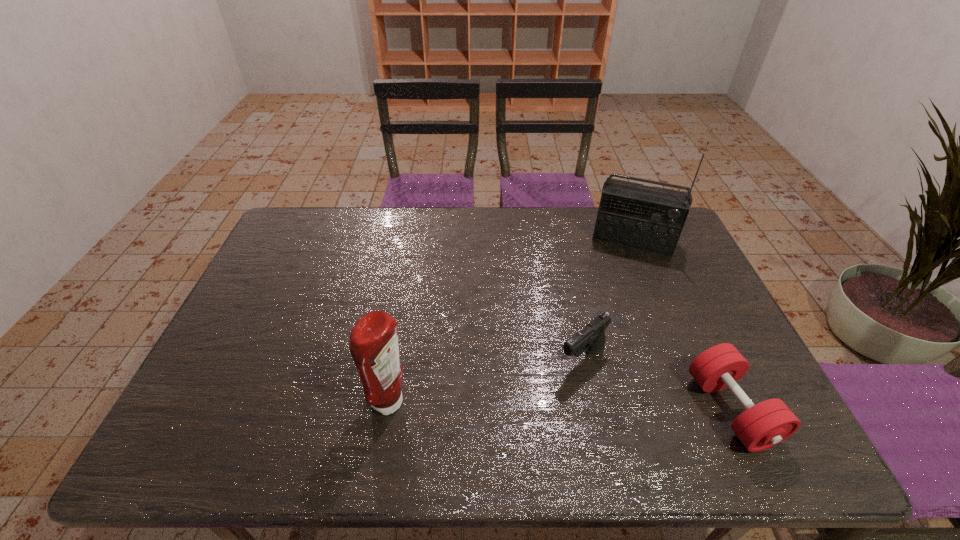
You are a GUI agent. You are given a task and a screenshot of the screen. Output one action in this format:
    pyautogui.click(x=<x>, y=<y>)
    Task: Click on the object present at the near right corner
    The image size is (960, 540).
    Given the screenshot: What is the action you would take?
    pyautogui.click(x=761, y=426)

The image size is (960, 540). I want to click on vacant area at the far edge of the desktop, so click(448, 212).

This screenshot has height=540, width=960. In the image, there is a desktop. Identify the location of vacant area at the near edge. (499, 401).

Identify the location of free point at the left edge. (273, 267).

Identify the location of vacant space at the right edge of the desktop. (673, 283).

Where is `vacant space at the far left corner of the desktop`? Image resolution: width=960 pixels, height=540 pixels. vacant space at the far left corner of the desktop is located at coordinates (305, 232).

You are a GUI agent. You are given a task and a screenshot of the screen. Output one action in this format:
    pyautogui.click(x=<x>, y=<y>)
    Task: Click on the vacant space at the far right corner
    The height and width of the screenshot is (540, 960).
    Given the screenshot: What is the action you would take?
    pyautogui.click(x=681, y=237)

You are a GUI agent. You are given a task and a screenshot of the screen. Output one action in this format:
    pyautogui.click(x=<x>, y=<y>)
    Task: Click on the free space between the pistol and the dumbbell
    
    Given the screenshot: What is the action you would take?
    pyautogui.click(x=657, y=384)

Locate an element on the screen. free space between the dumbbell and the pistol is located at coordinates (657, 384).

Image resolution: width=960 pixels, height=540 pixels. What are the coordinates of `vacant space in between the tallest object and the second tallest object` in the screenshot? It's located at (512, 321).